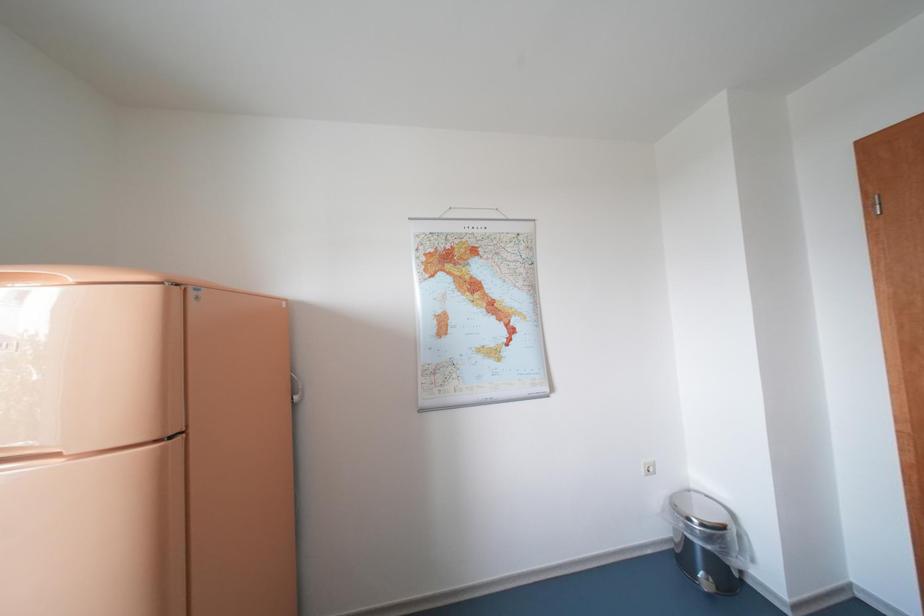
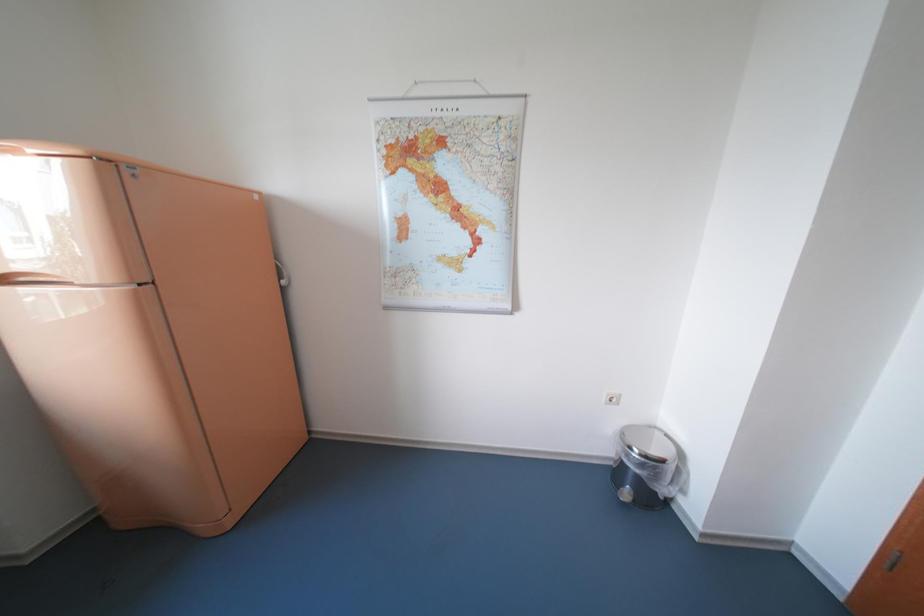
Question: How did the camera likely rotate?

Choices:
 (A) Left
 (B) Right
 (C) Up
 (D) Down

Answer: (D)